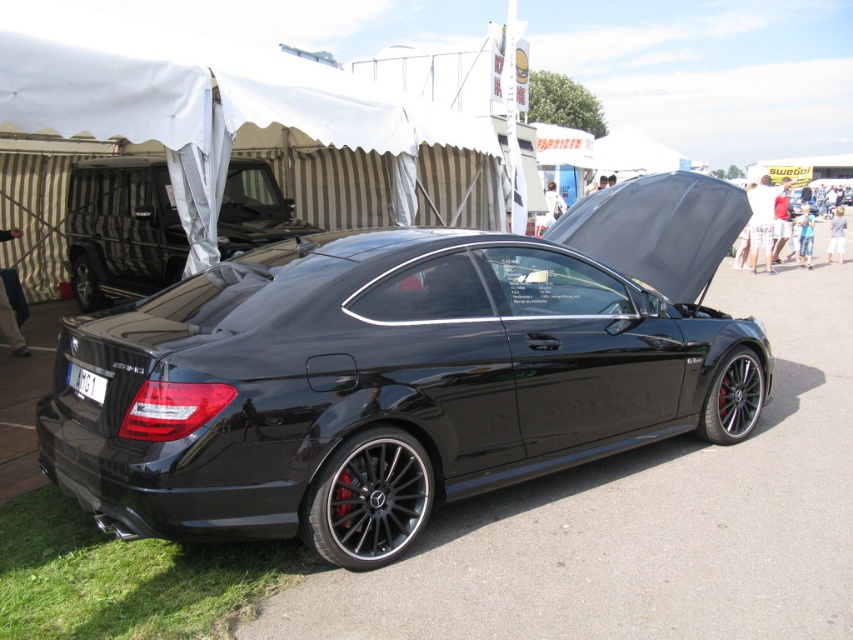
Question: Can you confirm if glossy black car at center is bigger than green grass at lower left?

Choices:
 (A) no
 (B) yes

Answer: (B)

Question: In this image, where is green grass at lower left located relative to black matte truck at upper left?

Choices:
 (A) above
 (B) below

Answer: (B)

Question: Which point is closer to the camera taking this photo?

Choices:
 (A) (316, 449)
 (B) (51, 529)

Answer: (A)

Question: Based on their relative distances, which object is nearer to the black plastic license plate at rear?

Choices:
 (A) green grass at lower left
 (B) glossy black car at center
 (C) black matte truck at upper left

Answer: (A)

Question: Which point appears closest to the camera in this image?

Choices:
 (A) (268, 545)
 (B) (164, 275)
 (C) (96, 401)

Answer: (C)

Question: Does glossy black car at center appear over black plastic license plate at rear?

Choices:
 (A) no
 (B) yes

Answer: (B)